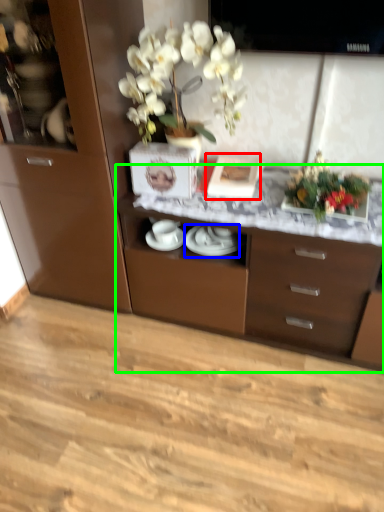
Question: Which object is the farthest from picture frame (highlighted by a red box)? Choose among these: tableware (highlighted by a blue box) or desk (highlighted by a green box).

Choices:
 (A) tableware
 (B) desk

Answer: (B)